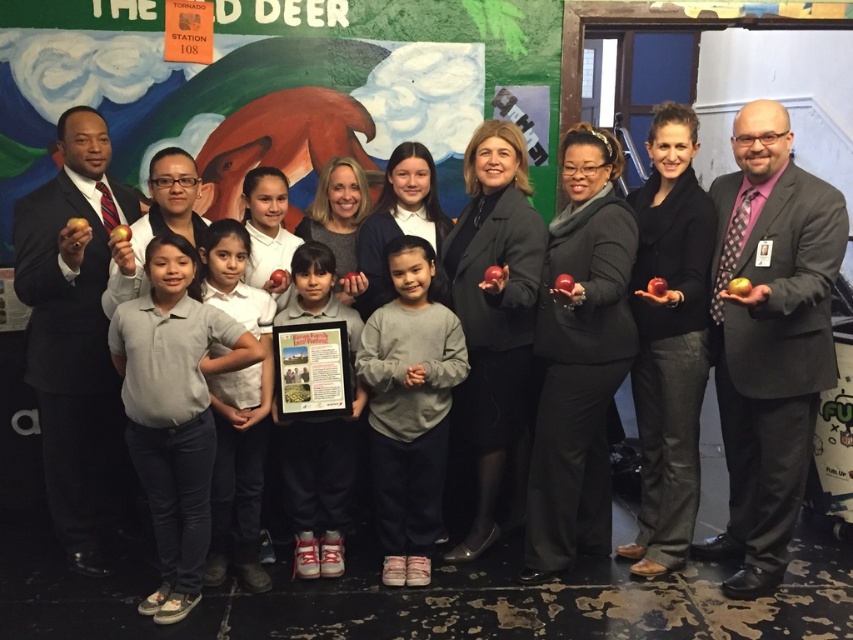
Question: Does matte black suit at center appear on the left side of gray cotton shirt at center?

Choices:
 (A) no
 (B) yes

Answer: (A)

Question: Which of the following is the farthest from the observer?

Choices:
 (A) (254, 461)
 (B) (125, 369)
 (C) (421, 563)
 (D) (753, 172)

Answer: (C)

Question: Which object is positioned closest to the gray fleece sweatshirt at center?

Choices:
 (A) gray cotton shirt at center
 (B) matte black suit at center
 (C) matte black suit at left

Answer: (A)

Question: Which point is farther to the camera?

Choices:
 (A) white cotton shirt at center
 (B) matte black suit at left

Answer: (A)

Question: Is matte black suit at center bigger than white cotton shirt at center?

Choices:
 (A) no
 (B) yes

Answer: (B)

Question: Is gray fleece sweatshirt at center thinner than white cotton shirt at center?

Choices:
 (A) yes
 (B) no

Answer: (B)